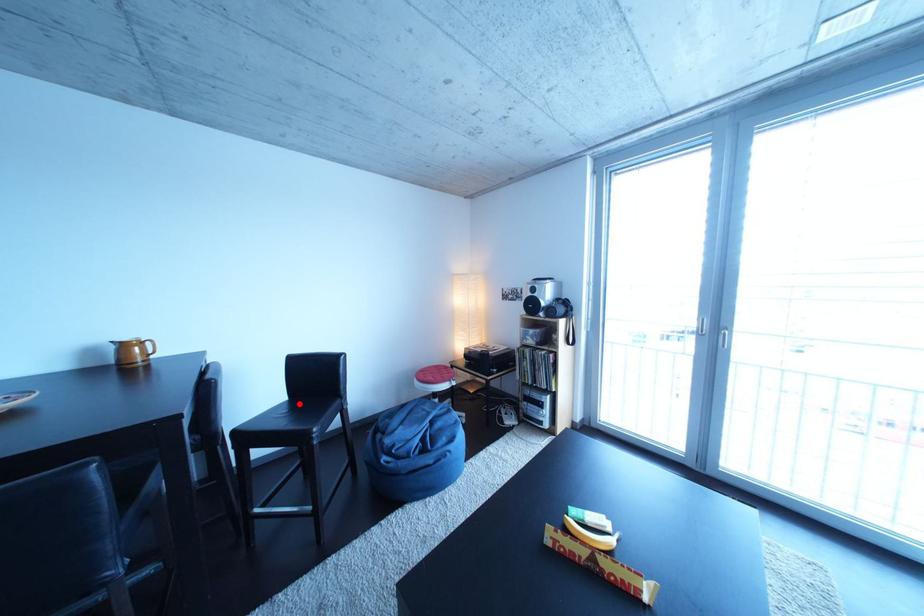
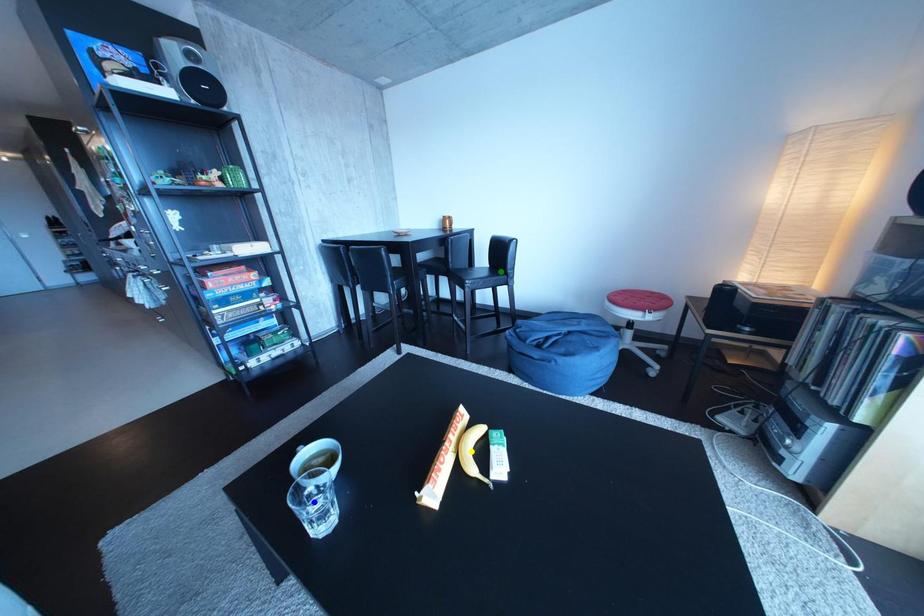
Question: I am providing you with two images of the same scene from different viewpoints. A red point is marked on the first image. You are given multiple points on the second image. Which spot in image 2 lines up with the point in image 1?

Choices:
 (A) green point
 (B) blue point
 (C) yellow point

Answer: (A)